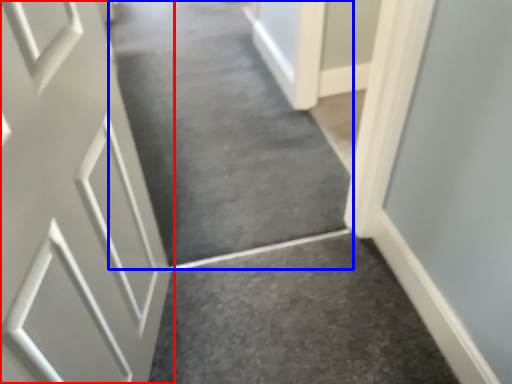
Question: Which object appears closest to the camera in this image, door (highlighted by a red box) or aisle (highlighted by a blue box)?

Choices:
 (A) door
 (B) aisle

Answer: (A)